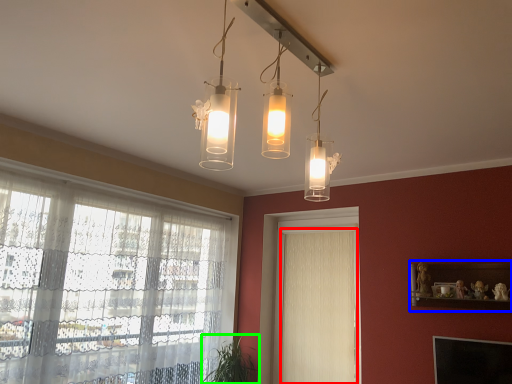
Question: Based on their relative distances, which object is nearer to curtain (highlighted by a red box)? Choose from shelf (highlighted by a blue box) and plant (highlighted by a green box).

Choices:
 (A) shelf
 (B) plant

Answer: (B)